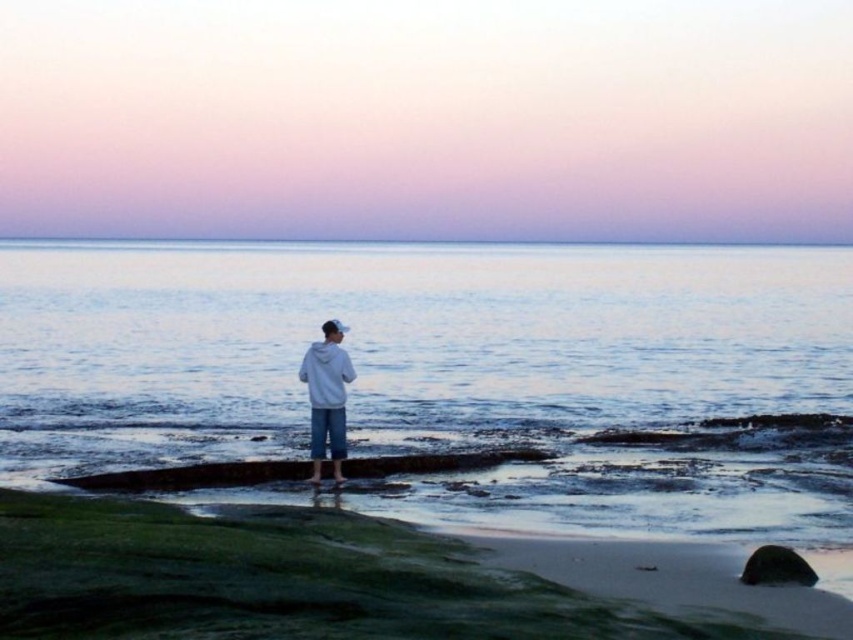
Question: Which of these objects is positioned closest to the smooth gray rock at lower right?

Choices:
 (A) white matte hoodie at center
 (B) blue water at center

Answer: (A)

Question: Which object is the closest to the white matte hoodie at center?

Choices:
 (A) smooth gray rock at lower right
 (B) blue water at center

Answer: (A)

Question: Among these objects, which one is farthest from the camera?

Choices:
 (A) blue water at center
 (B) white matte hoodie at center

Answer: (B)

Question: Is white matte hoodie at center below smooth gray rock at lower right?

Choices:
 (A) yes
 (B) no

Answer: (B)

Question: In this image, where is blue water at center located relative to smooth gray rock at lower right?

Choices:
 (A) right
 (B) left

Answer: (B)

Question: Does blue water at center have a greater width compared to smooth gray rock at lower right?

Choices:
 (A) yes
 (B) no

Answer: (A)